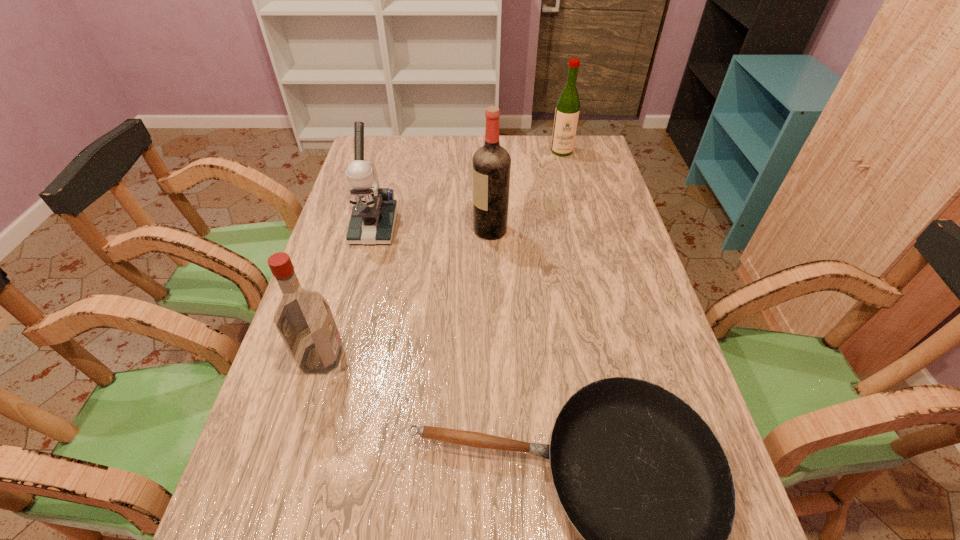
Where is `free space located 0.150m at the eyepiece of the microscope`? The width and height of the screenshot is (960, 540). free space located 0.150m at the eyepiece of the microscope is located at coordinates (359, 284).

Image resolution: width=960 pixels, height=540 pixels. Find the location of `vacant space positioned 0.240m on the front-facing side of the leftmost liquor`. vacant space positioned 0.240m on the front-facing side of the leftmost liquor is located at coordinates (447, 357).

Identify the location of object at the far edge. (567, 111).

Locate an element on the screen. The width and height of the screenshot is (960, 540). microscope located at the left edge is located at coordinates (374, 213).

At what (x,y) coordinates should I click in order to perform the action: click on liquor present at the left edge. Please return your answer as a coordinate pair (x, y). The image size is (960, 540). Looking at the image, I should click on (303, 318).

Locate an element on the screen. The height and width of the screenshot is (540, 960). object situated at the right edge is located at coordinates (567, 111).

Locate an element on the screen. The image size is (960, 540). object at the far right corner is located at coordinates (567, 111).

In the image, there is a desktop. At what (x,y) coordinates should I click in order to perform the action: click on vacant space at the far edge. Please return your answer as a coordinate pair (x, y). Looking at the image, I should click on (470, 149).

What are the coordinates of `vacant area at the left edge` in the screenshot? It's located at (391, 173).

You are a GUI agent. You are given a task and a screenshot of the screen. Output one action in this format:
    pyautogui.click(x=<x>, y=<y>)
    Task: Click on the free region at the right edge of the desktop
    
    Given the screenshot: What is the action you would take?
    pyautogui.click(x=612, y=312)